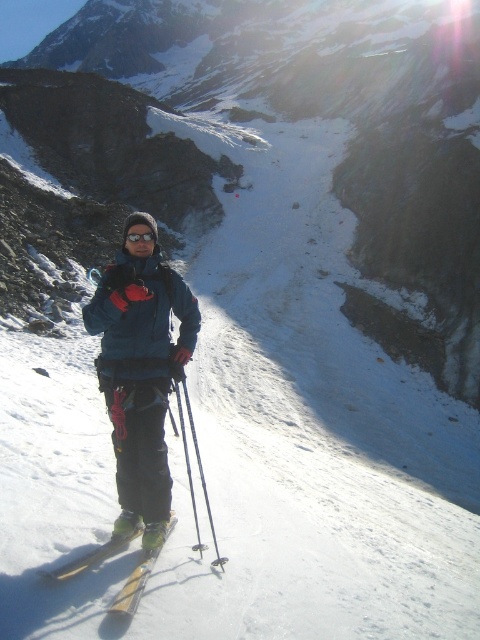
You are a mountain guide assessing the safety of a client. The client is wearing a matte blue jacket at center and holding a metallic silver ski pole at center. Based on their positioning, can you determine which item is closer to you?

The matte blue jacket at center is closer to you because it is in front of the metallic silver ski pole at center.

From the picture: You are a photographer positioned at the camera. You want to capture a closeup shot of the matte blue jacket at center. Considering the distance, will you need to use a zoom lens?

The matte blue jacket at center is 11.06 meters away from the camera. To capture a closeup shot from this distance, you would need to use a zoom lens to bring the subject into focus and fill the frame.

In the scene shown: You are a mountain guide assessing the visibility of equipment for a safety check. You need to ensure that the matte blue jacket at center and the yellow metallic ski at lower center are both visible to the rescue team from above. Based on their positions, which equipment is more likely to be obscured by the other?

The yellow metallic ski at lower center is more likely to be obscured because the matte blue jacket at center is positioned over it, blocking part of its view from above.